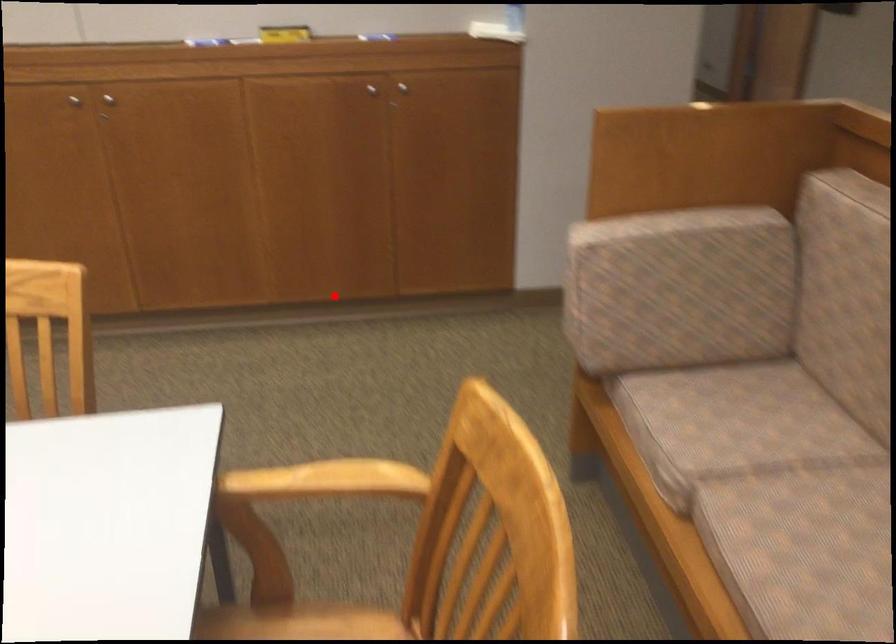
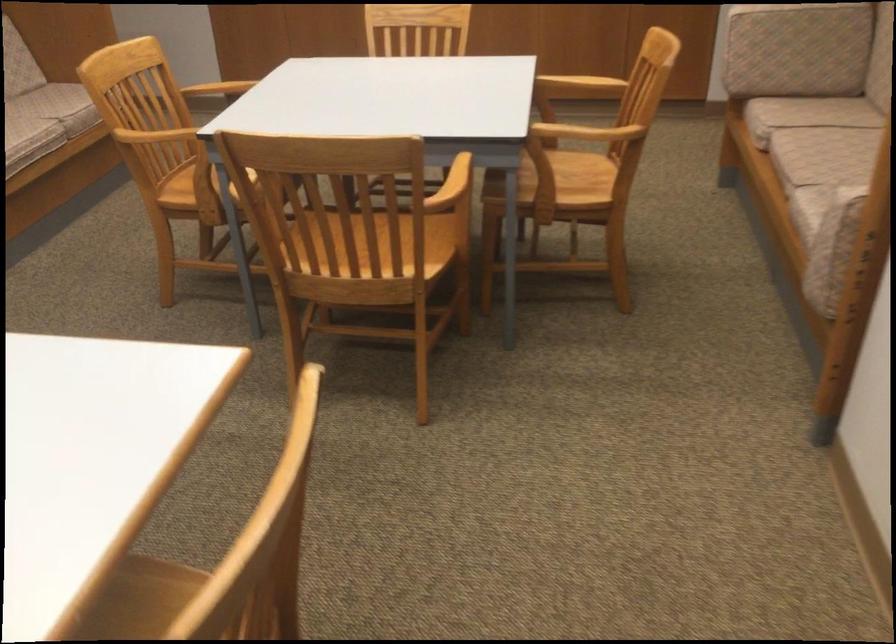
Question: I am providing you with two images of the same scene from different viewpoints. In image1, a red point is highlighted. Considering the same 3D point in image2, which of the following is correct?

Choices:
 (A) It is closer
 (B) It is farther

Answer: (B)